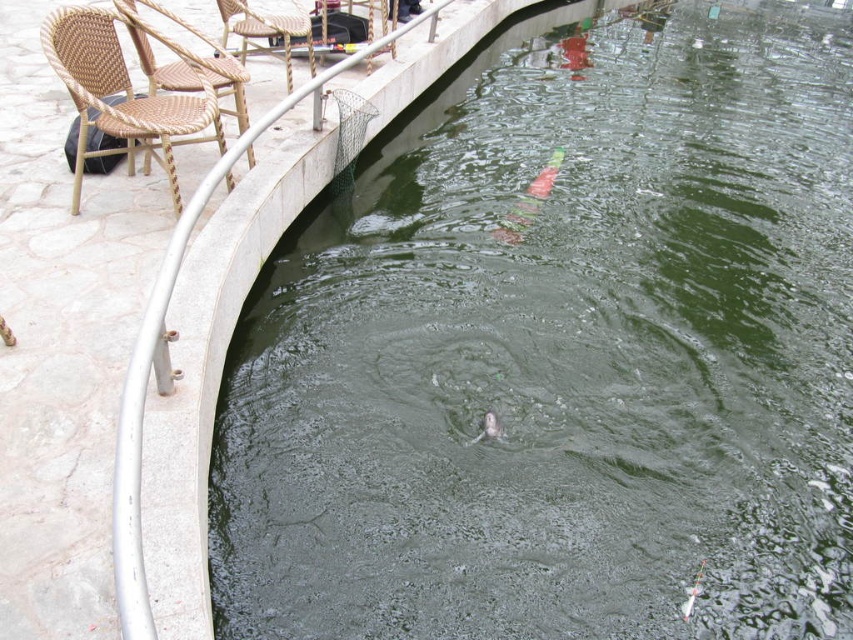
Question: Which of the following is the farthest from the observer?

Choices:
 (A) shiny silver fish at center
 (B) woven rattan chair at upper left
 (C) woven rattan chair at left

Answer: (B)

Question: Is woven rattan chair at left positioned at the back of shiny silver fish at center?

Choices:
 (A) no
 (B) yes

Answer: (A)

Question: Among these objects, which one is farthest from the camera?

Choices:
 (A) shiny silver fish at center
 (B) woven rattan chair at left
 (C) woven rattan chair at upper left
 (D) shiny pink fish at center

Answer: (D)

Question: Can you confirm if woven rattan chair at left is positioned to the right of woven rattan chair at upper left?

Choices:
 (A) yes
 (B) no

Answer: (B)

Question: Does woven rattan chair at left appear on the left side of woven wicker chair at upper left?

Choices:
 (A) no
 (B) yes

Answer: (B)

Question: Which object is closer to the camera taking this photo?

Choices:
 (A) shiny silver fish at center
 (B) woven wicker chair at upper left

Answer: (A)